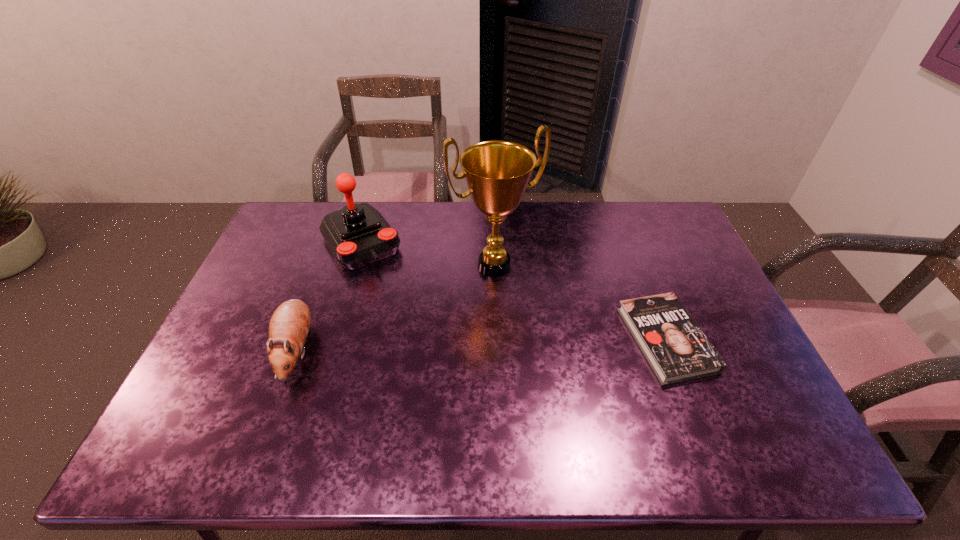
Locate an element on the screen. This screenshot has width=960, height=540. vacant area at the near edge of the desktop is located at coordinates (365, 397).

You are a GUI agent. You are given a task and a screenshot of the screen. Output one action in this format:
    pyautogui.click(x=<x>, y=<y>)
    Task: Click on the blank space at the left edge
    
    Given the screenshot: What is the action you would take?
    pyautogui.click(x=202, y=376)

What are the coordinates of `vacant position at the right edge of the desktop` in the screenshot? It's located at (663, 276).

Locate an element on the screen. The width and height of the screenshot is (960, 540). vacant space at the far left corner is located at coordinates (296, 219).

This screenshot has width=960, height=540. In the image, there is a desktop. Find the location of `vacant area at the far right corner`. vacant area at the far right corner is located at coordinates (648, 240).

Where is `vacant area that lies between the hamster and the tallest object`? This screenshot has height=540, width=960. vacant area that lies between the hamster and the tallest object is located at coordinates (396, 308).

Find the location of a particular element. This screenshot has height=540, width=960. vacant point located between the hamster and the award is located at coordinates (396, 308).

Where is `free space between the joystick and the book`? The image size is (960, 540). free space between the joystick and the book is located at coordinates (514, 291).

Find the location of a particular element. The height and width of the screenshot is (540, 960). free space that is in between the rightmost object and the tallest object is located at coordinates (580, 302).

This screenshot has width=960, height=540. Find the location of `free space between the shortest object and the hamster`. free space between the shortest object and the hamster is located at coordinates (481, 345).